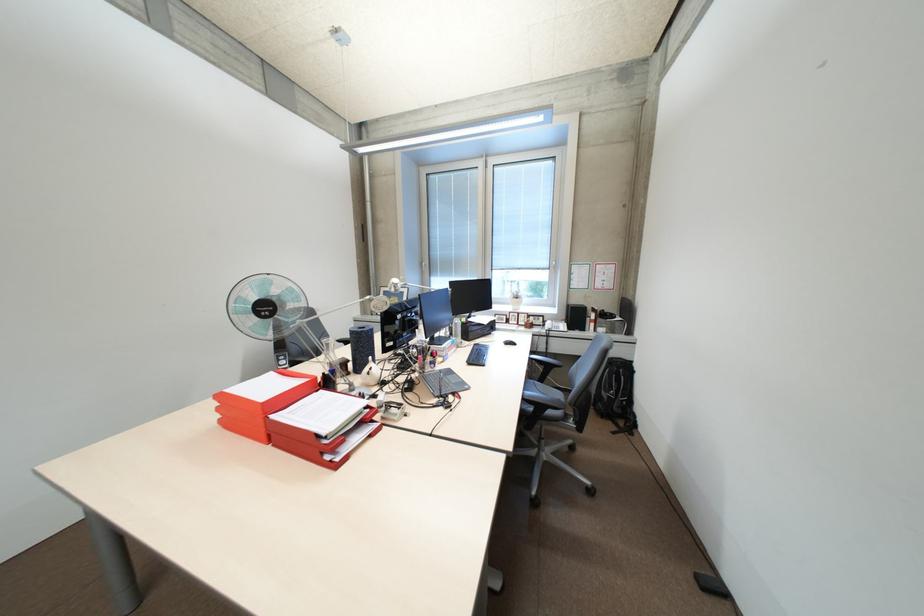
Describe the element at coordinates (282, 360) in the screenshot. I see `the fan control button` at that location.